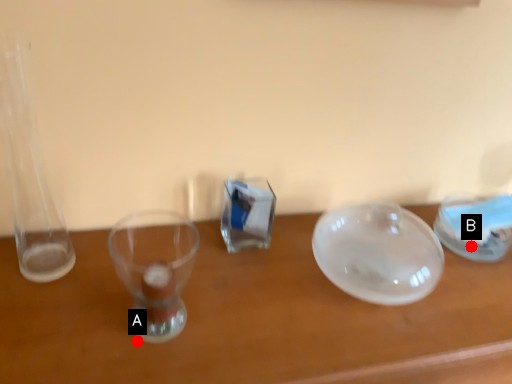
Question: Two points are circled on the image, labeled by A and B beside each circle. Among these points, which one is farthest from the camera?

Choices:
 (A) A is further
 (B) B is further

Answer: (B)